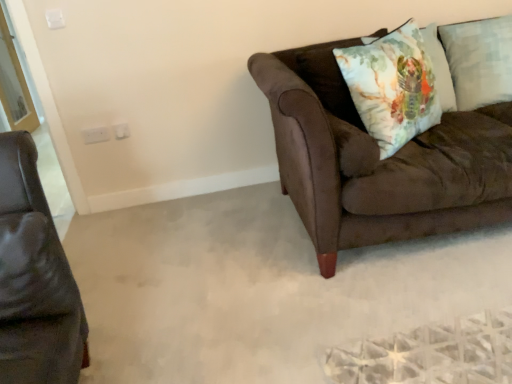
Question: From a real-world perspective, is brown leather armchair at left located beneath watercolor fabric pillow at upper right?

Choices:
 (A) no
 (B) yes

Answer: (B)

Question: Is brown leather armchair at left thinner than watercolor fabric pillow at upper right?

Choices:
 (A) no
 (B) yes

Answer: (A)

Question: Could watercolor fabric pillow at upper right be considered to be inside brown leather armchair at left?

Choices:
 (A) yes
 (B) no

Answer: (B)

Question: Does brown leather armchair at left lie behind watercolor fabric pillow at upper right?

Choices:
 (A) yes
 (B) no

Answer: (B)

Question: Is brown leather armchair at left positioned with its back to watercolor fabric pillow at upper right?

Choices:
 (A) yes
 (B) no

Answer: (B)

Question: From a real-world perspective, relative to matte black leather couch at left, marked as the second studio couch in a right-to-left arrangement, is light blue textured pillow at upper right, which is the second pillow from left to right, vertically above or below?

Choices:
 (A) below
 (B) above

Answer: (B)

Question: Does point (502, 87) appear closer or farther from the camera than point (71, 301)?

Choices:
 (A) closer
 (B) farther

Answer: (B)

Question: Relative to matte black leather couch at left, which appears as the 2th studio couch when viewed from the back, is light blue textured pillow at upper right, the first pillow positioned from the right, in front or behind?

Choices:
 (A) front
 (B) behind

Answer: (B)

Question: From the image's perspective, is light blue textured pillow at upper right, which is the second pillow from left to right, positioned above or below matte black leather couch at left, which is counted as the first studio couch, starting from the front?

Choices:
 (A) above
 (B) below

Answer: (A)

Question: Based on their sizes in the image, would you say suede brown couch at right, the 2th studio couch positioned from the left, is bigger or smaller than light blue textured pillow at upper right, the first pillow positioned from the right?

Choices:
 (A) big
 (B) small

Answer: (A)

Question: In terms of width, does suede brown couch at right, which is the 2th studio couch in front-to-back order, look wider or thinner when compared to light blue textured pillow at upper right, the first pillow positioned from the right?

Choices:
 (A) wide
 (B) thin

Answer: (A)

Question: From a real-world perspective, is suede brown couch at right, positioned as the first studio couch in back-to-front order, physically located above or below light blue textured pillow at upper right, the first pillow positioned from the right?

Choices:
 (A) above
 (B) below

Answer: (B)

Question: In terms of height, does suede brown couch at right, positioned as the first studio couch in back-to-front order, look taller or shorter compared to light blue textured pillow at upper right, which is the second pillow from left to right?

Choices:
 (A) short
 (B) tall

Answer: (B)

Question: In terms of width, does watercolor fabric pillow at upper right look wider or thinner when compared to brown leather armchair at left?

Choices:
 (A) thin
 (B) wide

Answer: (A)

Question: Is watercolor fabric pillow at upper right taller or shorter than brown leather armchair at left?

Choices:
 (A) tall
 (B) short

Answer: (A)